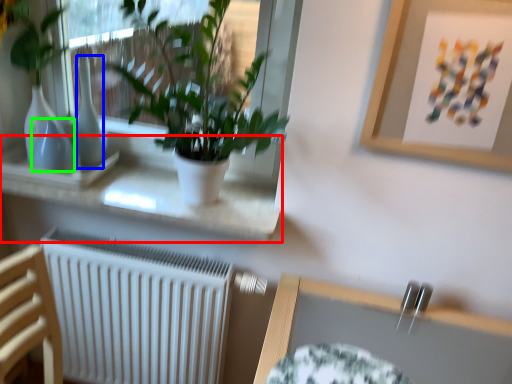
Question: Estimate the real-world distances between objects in this image. Which object is farther from window sill (highlighted by a red box), vase (highlighted by a blue box) or vase (highlighted by a green box)?

Choices:
 (A) vase
 (B) vase

Answer: (B)